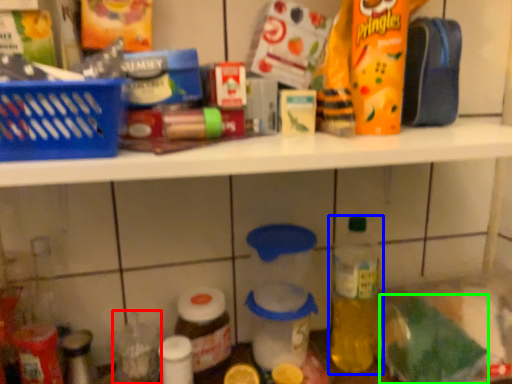
Question: Which object is the farthest from bottle (highlighted by a red box)? Choose among these: bottle (highlighted by a blue box) or food (highlighted by a green box).

Choices:
 (A) bottle
 (B) food

Answer: (B)